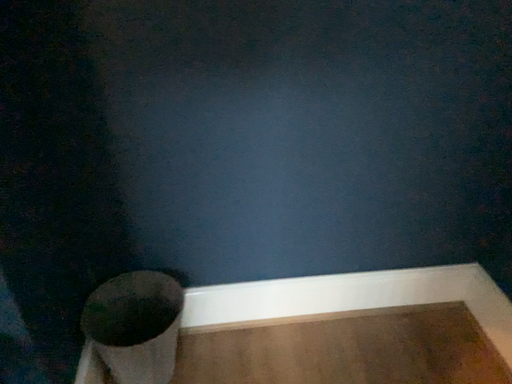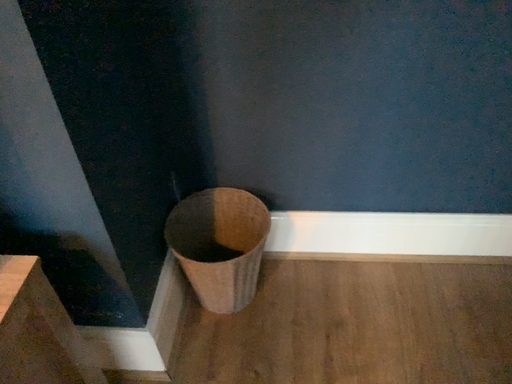
Question: Which way did the camera rotate in the video?

Choices:
 (A) rotated downward
 (B) rotated upward

Answer: (A)